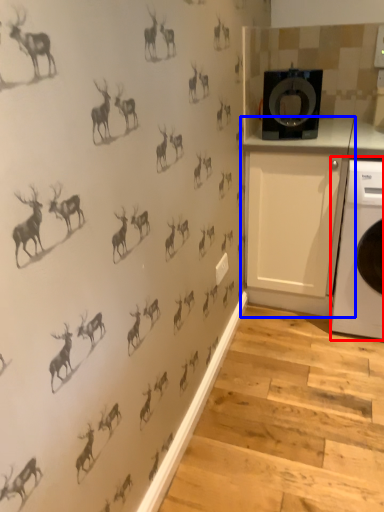
Question: Which object appears closest to the camera in this image, home appliance (highlighted by a red box) or cabinetry (highlighted by a blue box)?

Choices:
 (A) home appliance
 (B) cabinetry

Answer: (A)